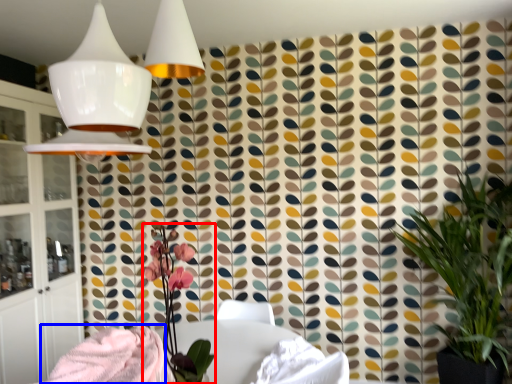
Question: Which object appears farthest to the camera in this image, floral arrangement (highlighted by a red box) or blanket (highlighted by a blue box)?

Choices:
 (A) floral arrangement
 (B) blanket

Answer: (B)